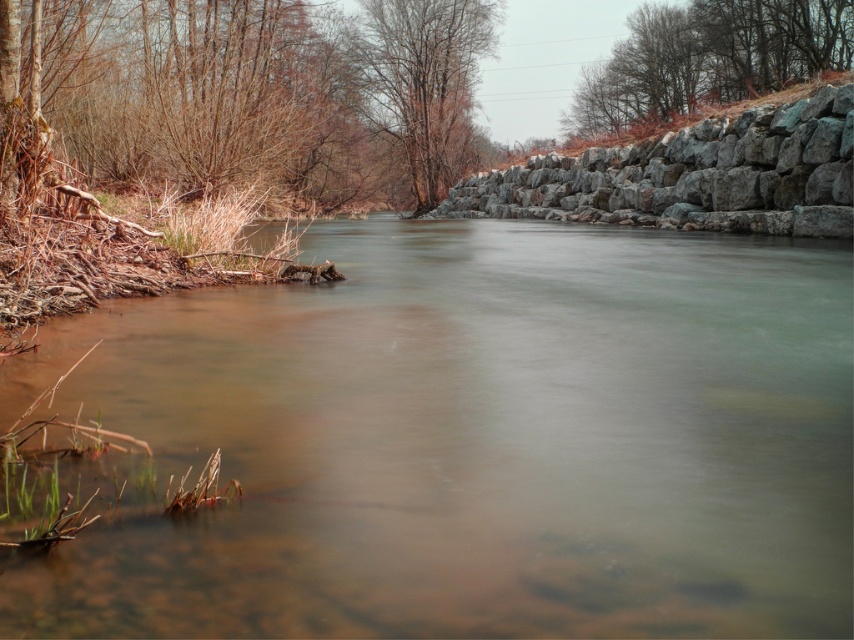
You are a photographer planning to capture a shot of the brown textured rock at upper right and the bare wood tree at upper center in the river scene. Based on their positions, which object would appear closer to the camera in the final photograph?

The brown textured rock at upper right appears closer to the camera than the bare wood tree at upper center because it is positioned under it, indicating it is in a lower plane in the image.

You are a hiker planning to cross the river using the rocks in the scene. You need to choose between the gray rock wall at right and the brown textured rock at upper right. Based on their widths, which rock would provide a wider stepping surface for your foot?

The brown textured rock at upper right has a greater width than the gray rock wall at right, so it would provide a wider stepping surface for your foot.